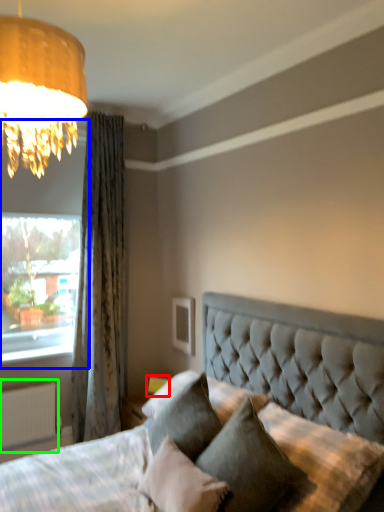
Question: Considering the real-world distances, which object is farthest from table lamp (highlighted by a red box)? window (highlighted by a blue box) or radiator (highlighted by a green box)?

Choices:
 (A) window
 (B) radiator

Answer: (A)